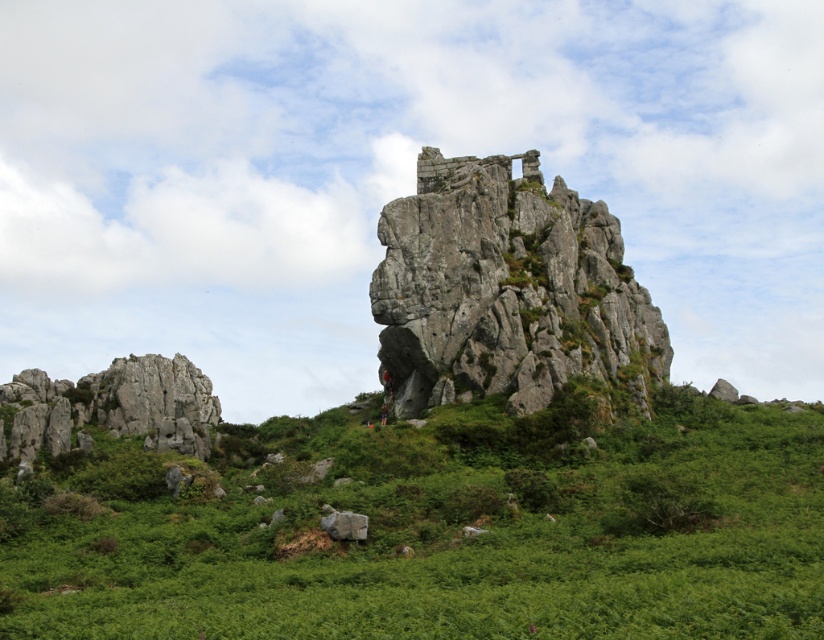
You are an archaeologist examining the rugged landscape. You notice the rough stone rock at left and the gray rough rock at lower center. Which rock would you estimate has a greater volume based on their sizes?

The rough stone rock at left is larger in size than the gray rough rock at lower center, so it likely has a greater volume.

You are standing in front of the ancient rock formation and notice two points marked on the image. The first point is at coordinates point (733, 636) and the second is at point (336, 524). Which point is nearer to your current position?

Point (733, 636) is closer to the camera than point (336, 524), so the first point is nearer to your current position.